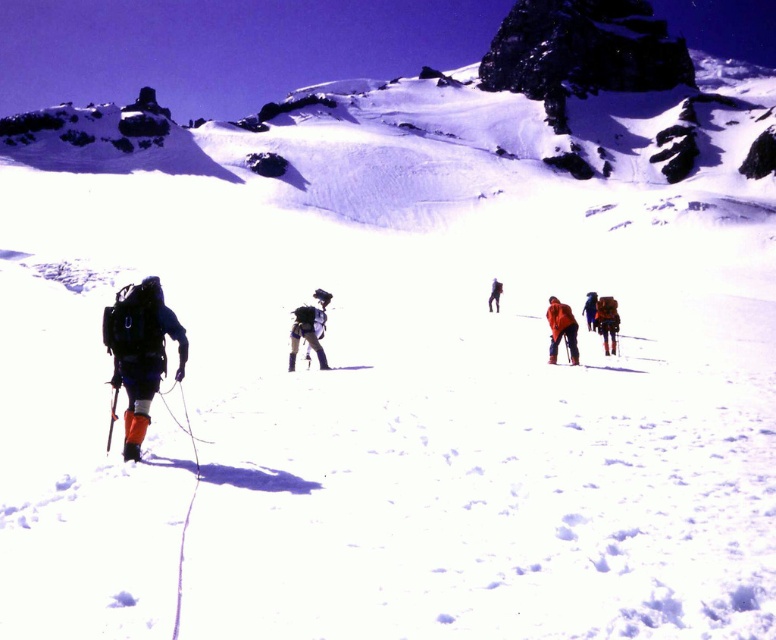
Question: Estimate the real-world distances between objects in this image. Which object is closer to the orange fabric pants at left?

Choices:
 (A) orange fabric ski at center
 (B) orange fabric jacket at center-right
 (C) matte black backpack at center

Answer: (C)

Question: Is snowy rock at upper center below orange fabric backpack at center?

Choices:
 (A) no
 (B) yes

Answer: (A)

Question: Is orange fabric backpack at center in front of orange fabric ski at center?

Choices:
 (A) yes
 (B) no

Answer: (B)

Question: Which object appears closest to the camera in this image?

Choices:
 (A) orange fabric backpack at right
 (B) orange fabric backpack at center
 (C) orange fabric ski at center
 (D) orange fabric pants at left

Answer: (D)

Question: Is matte black backpack at center thinner than orange fabric ski at center?

Choices:
 (A) yes
 (B) no

Answer: (B)

Question: Which point appears closest to the camera in this image?

Choices:
 (A) (553, 360)
 (B) (123, 451)

Answer: (B)